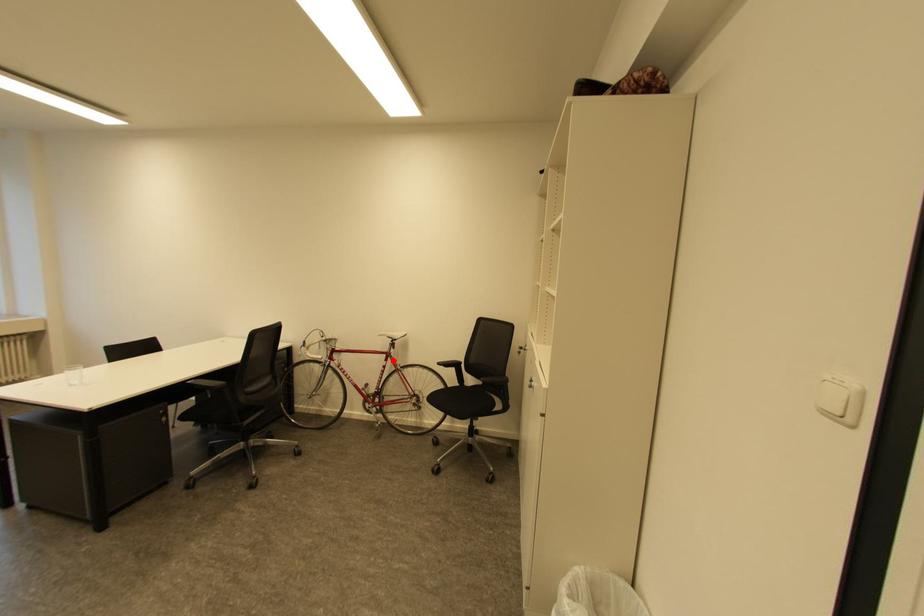
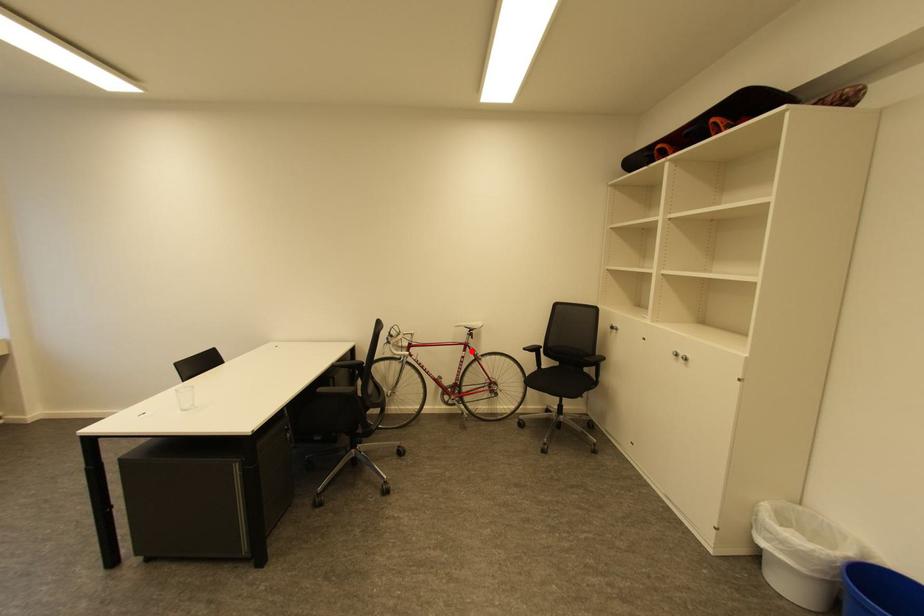
I am providing you with two images of the same scene from different viewpoints. A red point is marked on the first image and another point is marked on the second image. Does the point marked in image1 correspond to the same location as the one in image2?

Yes